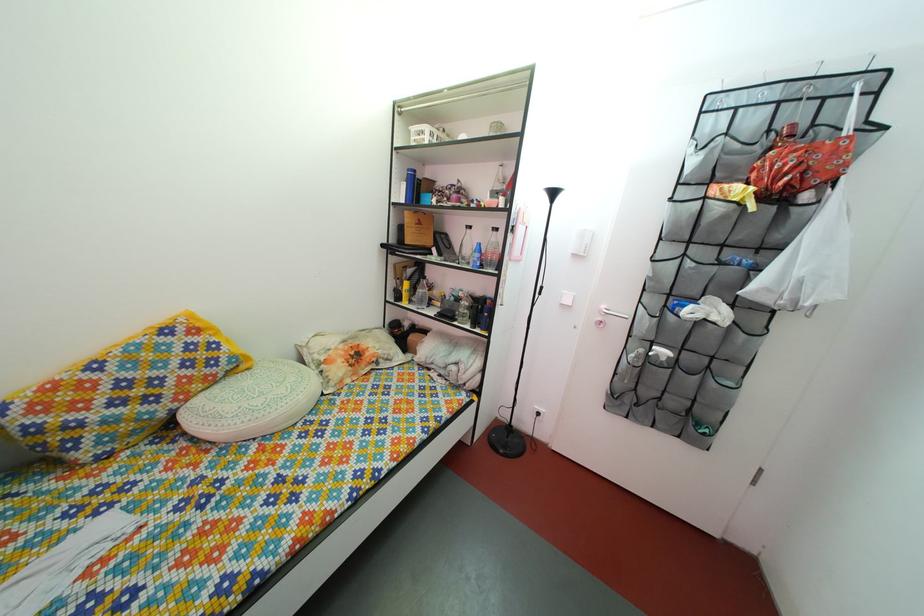
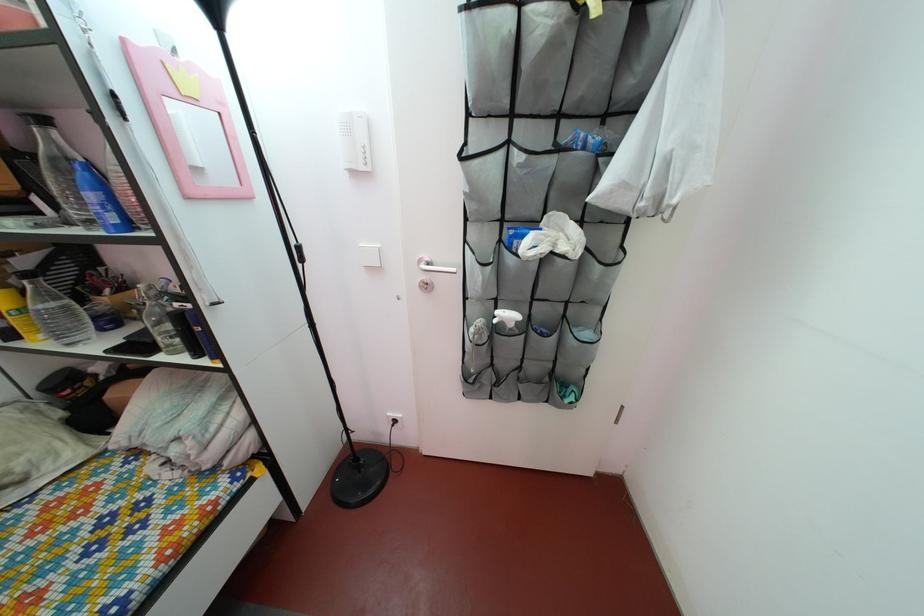
Where in the second image is the point corresponding to (x=419, y=280) from the first image?

(32, 270)